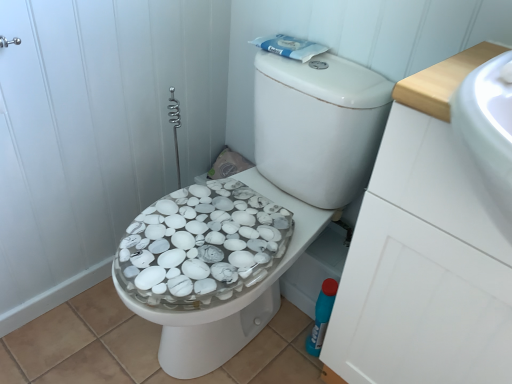
This screenshot has height=384, width=512. Describe the element at coordinates (418, 305) in the screenshot. I see `white glossy drawer at right` at that location.

Measure the distance between point (398, 292) and camera.

A distance of 31.89 inches exists between point (398, 292) and camera.

Where is `white glossy drawer at right`? white glossy drawer at right is located at coordinates (418, 305).

The height and width of the screenshot is (384, 512). I want to click on white marble bidet at center, so click(264, 279).

What do you see at coordinates (264, 279) in the screenshot? I see `white marble bidet at center` at bounding box center [264, 279].

This screenshot has height=384, width=512. In order to click on white glossy drawer at right in this screenshot , I will do `click(418, 305)`.

Does white glossy drawer at right appear on the left side of white marble bidet at center?

Incorrect, white glossy drawer at right is not on the left side of white marble bidet at center.

Is white glossy drawer at right in front of or behind white marble bidet at center in the image?

Clearly, white glossy drawer at right is in front of white marble bidet at center.

Which point is more distant from viewer, (x=454, y=369) or (x=266, y=181)?

The point (x=266, y=181) is farther.

From the picture: From the image's perspective, is white glossy drawer at right under white marble bidet at center?

Incorrect, from the image's perspective, white glossy drawer at right is higher than white marble bidet at center.

From a real-world perspective, is white glossy drawer at right beneath white marble bidet at center?

Incorrect, from a real-world perspective, white glossy drawer at right is higher than white marble bidet at center.

Looking at their sizes, would you say white glossy drawer at right is wider or thinner than white marble bidet at center?

Considering their sizes, white glossy drawer at right looks slimmer than white marble bidet at center.

Consider the image. Between white glossy drawer at right and white marble bidet at center, which one has more height?

Standing taller between the two is white glossy drawer at right.

Which of these two, white glossy drawer at right or white marble bidet at center, is bigger?

Bigger between the two is white glossy drawer at right.

Is white glossy drawer at right spatially inside white marble bidet at center, or outside of it?

white glossy drawer at right lies outside white marble bidet at center.

Is there a large distance between white glossy drawer at right and white marble bidet at center?

white glossy drawer at right is actually quite close to white marble bidet at center.

Is white glossy drawer at right aimed at white marble bidet at center?

No, white glossy drawer at right is not oriented towards white marble bidet at center.

How many degrees apart are the facing directions of white glossy drawer at right and white marble bidet at center?

89.4 degrees.

This screenshot has height=384, width=512. Identify the location of bidet below the white glossy drawer at right (from the image's perspective). (264, 279).

In the image, is white marble bidet at center on the left side or the right side of white glossy drawer at right?

In the image, white marble bidet at center appears on the left side of white glossy drawer at right.

Is white marble bidet at center positioned behind white glossy drawer at right?

Yes, it is.

Does point (249, 183) appear closer or farther from the camera than point (382, 217)?

Point (249, 183) is positioned farther from the camera compared to point (382, 217).

Looking at this image, from the image's perspective, is white marble bidet at center above or below white glossy drawer at right?

white marble bidet at center is situated lower than white glossy drawer at right in the image.

From a real-world perspective, is white marble bidet at center under white glossy drawer at right?

Yes, from a real-world perspective, white marble bidet at center is beneath white glossy drawer at right.

Considering the sizes of white marble bidet at center and white glossy drawer at right in the image, is white marble bidet at center wider or thinner than white glossy drawer at right?

In the image, white marble bidet at center appears to be wider than white glossy drawer at right.

Between white marble bidet at center and white glossy drawer at right, which one has less height?

With less height is white marble bidet at center.

Can you confirm if white marble bidet at center is bigger than white glossy drawer at right?

No.

Would you say white marble bidet at center contains white glossy drawer at right?

No.

Is white marble bidet at center positioned far away from white glossy drawer at right?

No, white marble bidet at center is in close proximity to white glossy drawer at right.

Is white marble bidet at center looking in the opposite direction of white glossy drawer at right?

white marble bidet at center does not have its back to white glossy drawer at right.

Image resolution: width=512 pixels, height=384 pixels. In order to click on bidet below the white glossy drawer at right (from a real-world perspective) in this screenshot , I will do `click(264, 279)`.

This screenshot has width=512, height=384. Find the location of `drawer that appears on the right of white marble bidet at center`. drawer that appears on the right of white marble bidet at center is located at coordinates (418, 305).

Locate an element on the screen. This screenshot has width=512, height=384. drawer in front of the white marble bidet at center is located at coordinates (418, 305).